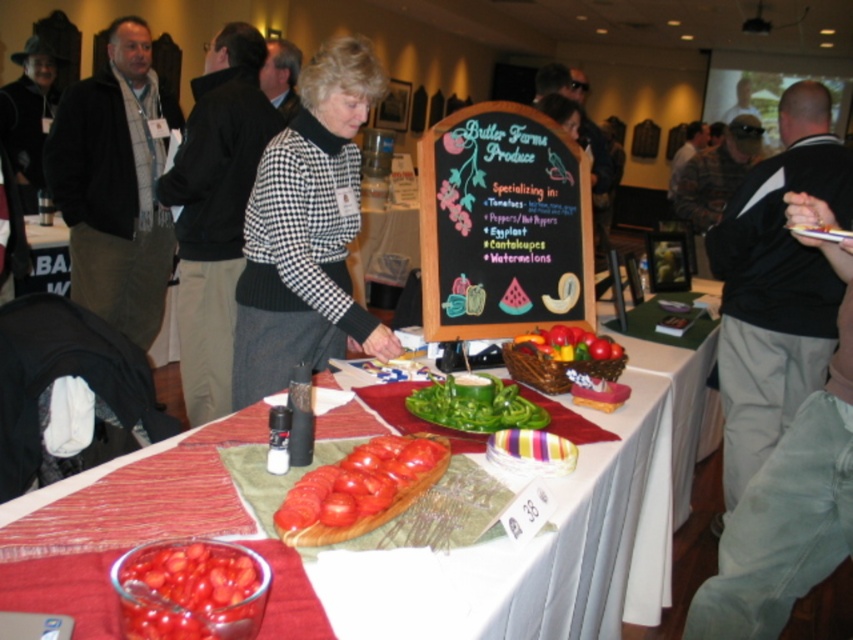
What is located at the coordinate point (502, 225) in the image?

The point (502, 225) is on the black chalkboard at center.

From the picture: You are standing at the point labeled point (x=227, y=49) and want to walk to point (x=351, y=465). Given that you can only move forward in a straight line, will you be able to reach the destination without changing direction?

Yes, you can reach point (x=351, y=465) from point (x=227, y=49) by moving forward in a straight line since point (x=227, y=49) is closer to the viewer, meaning the path is unobstructed.

You are a customer at the market and want to read the signboard behind the woman. Can you see the black chalkboard at center from your current position if the black sweater at upper right is blocking your view?

The black chalkboard at center is located above the black sweater at upper right, so you can still see the black chalkboard at center from your current position as it is positioned higher than the blocking sweater.